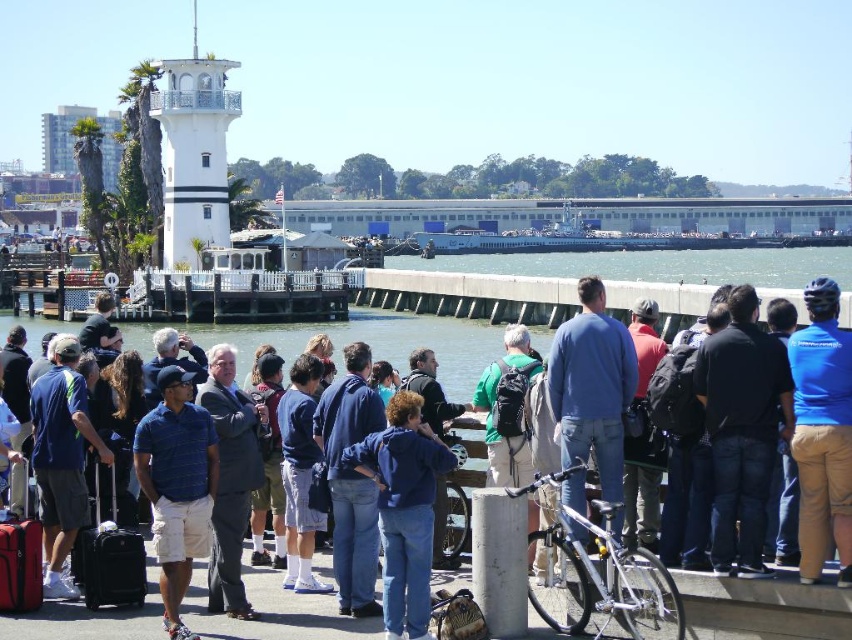
Question: Among these objects, which one is farthest from the camera?

Choices:
 (A) blue cotton shirt at center
 (B) matte black suitcase at lower left
 (C) black hard suitcase at center
 (D) blue fabric helmet at upper right

Answer: (A)

Question: Does blue fabric helmet at upper right have a larger size compared to blue denim jacket at center?

Choices:
 (A) yes
 (B) no

Answer: (A)

Question: Which of these objects is positioned farthest from the blue denim jacket at center?

Choices:
 (A) blue fabric helmet at upper right
 (B) black hard suitcase at center

Answer: (A)

Question: Which object is farther from the camera taking this photo?

Choices:
 (A) matte black suitcase at lower left
 (B) black hard suitcase at center
 (C) blue cotton shirt at center

Answer: (C)

Question: Is blue fabric helmet at upper right further to the viewer compared to black hard suitcase at center?

Choices:
 (A) yes
 (B) no

Answer: (B)

Question: Considering the relative positions of black hard suitcase at center and matte black suitcase at lower left in the image provided, where is black hard suitcase at center located with respect to matte black suitcase at lower left?

Choices:
 (A) left
 (B) right

Answer: (B)